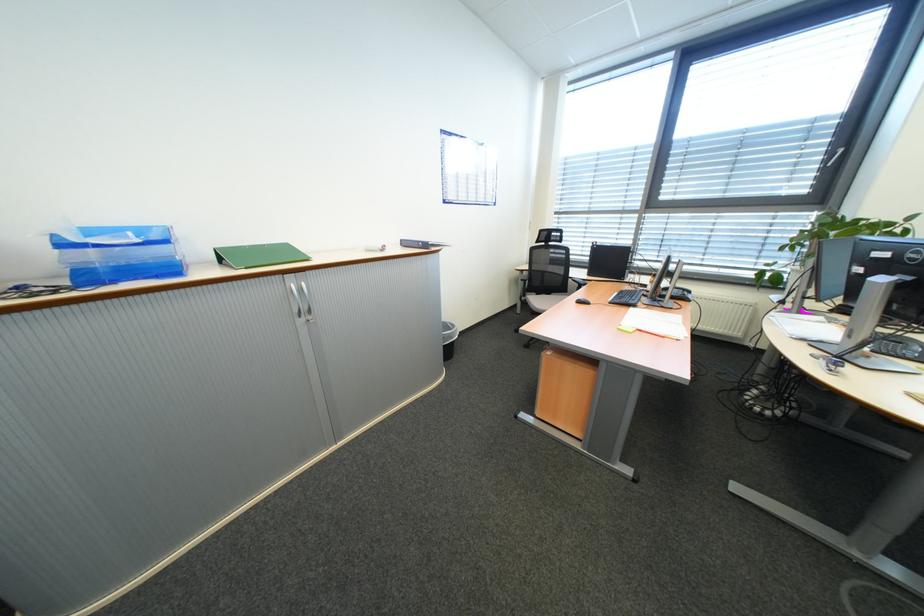
Where would you rest the chair armrest? Please return your answer as a coordinate pair (x, y).

(521, 270)